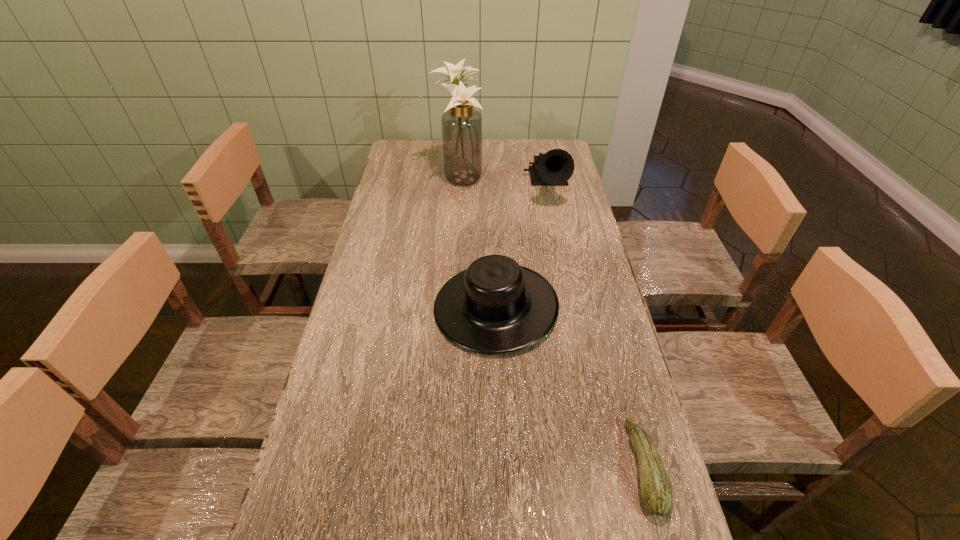
Where is `flower arrangement`? This screenshot has height=540, width=960. flower arrangement is located at coordinates (461, 124).

You are a GUI agent. You are given a task and a screenshot of the screen. Output one action in this format:
    pyautogui.click(x=<x>, y=<y>)
    Task: Click on the second tallest object
    
    Given the screenshot: What is the action you would take?
    pyautogui.click(x=554, y=168)

I want to click on dress hat, so [495, 306].

You are a GUI agent. You are given a task and a screenshot of the screen. Output one action in this format:
    pyautogui.click(x=<x>, y=<y>)
    Task: Click on the second nearest object
    The image size is (960, 540).
    Given the screenshot: What is the action you would take?
    pyautogui.click(x=495, y=306)

At what (x,y) coordinates should I click in order to perform the action: click on the shortest object. Please return your answer as a coordinate pair (x, y). Looking at the image, I should click on pos(656,491).

Where is `the nearest object`? The height and width of the screenshot is (540, 960). the nearest object is located at coordinates (656, 491).

Find the location of `vacant point located on the left of the flower arrangement`. vacant point located on the left of the flower arrangement is located at coordinates (386, 178).

The width and height of the screenshot is (960, 540). In order to click on free region located from the horn of the phonograph_record in this screenshot , I will do `click(557, 237)`.

At what (x,y) coordinates should I click in order to perform the action: click on free location located 0.150m on the front of the third farthest object. Please return your answer as a coordinate pair (x, y). Looking at the image, I should click on (499, 412).

Identify the location of vacant region located at the stem end of the nearest object. This screenshot has width=960, height=540. click(x=535, y=467).